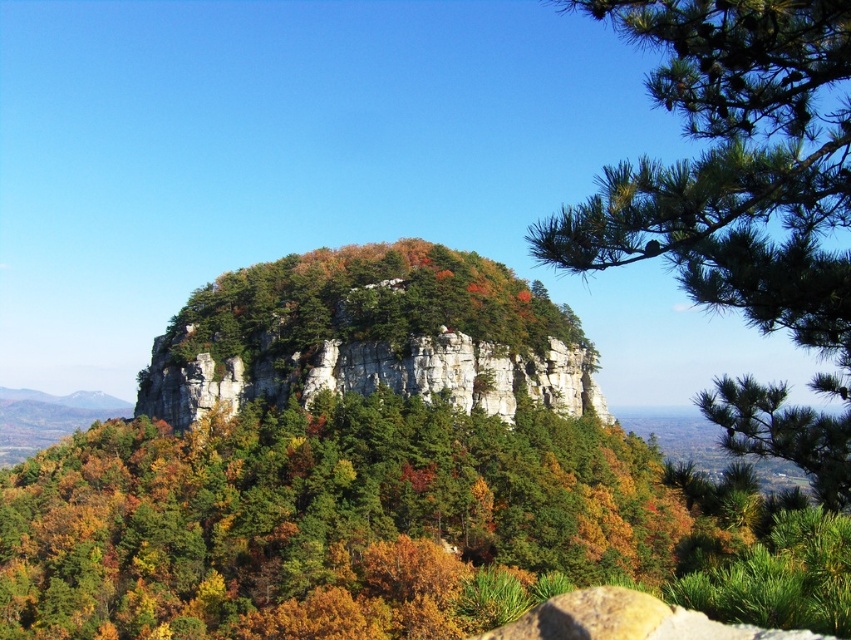
Can you confirm if green matte tree at center is taller than green needle-like branches at upper right?

No.

Is the position of green matte tree at center more distant than that of green needle-like branches at upper right?

Yes.

Between point (49, 464) and point (770, 192), which one is positioned behind?

The point (49, 464) is more distant.

This screenshot has width=851, height=640. I want to click on green matte tree at center, so click(386, 528).

Is green matte tree at center thinner than rocky cliff at center?

No.

Who is positioned more to the left, green matte tree at center or rocky cliff at center?

rocky cliff at center is more to the left.

What do you see at coordinates (386, 528) in the screenshot?
I see `green matte tree at center` at bounding box center [386, 528].

Find the location of `green matte tree at center`. green matte tree at center is located at coordinates (386, 528).

Who is positioned more to the left, green needle-like branches at upper right or rocky cliff at center?

From the viewer's perspective, rocky cliff at center appears more on the left side.

Does green needle-like branches at upper right appear on the right side of rocky cliff at center?

Correct, you'll find green needle-like branches at upper right to the right of rocky cliff at center.

What are the coordinates of `green needle-like branches at upper right` in the screenshot? It's located at (740, 202).